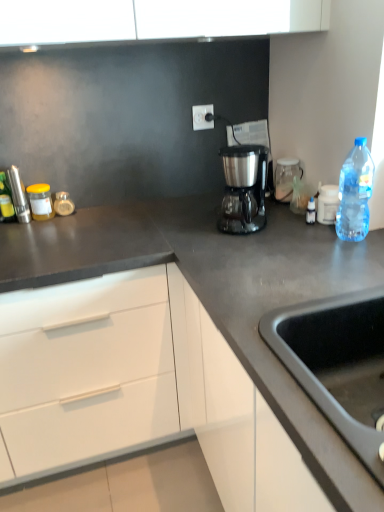
What are the coordinates of `vacant space situated on the left part of satin metallic coffee maker at center` in the screenshot? It's located at (188, 232).